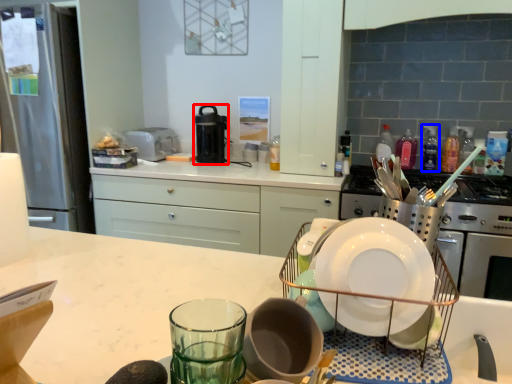
Question: Which point is further to the camera, kitchen appliance (highlighted by a red box) or bottle (highlighted by a blue box)?

Choices:
 (A) kitchen appliance
 (B) bottle

Answer: (A)